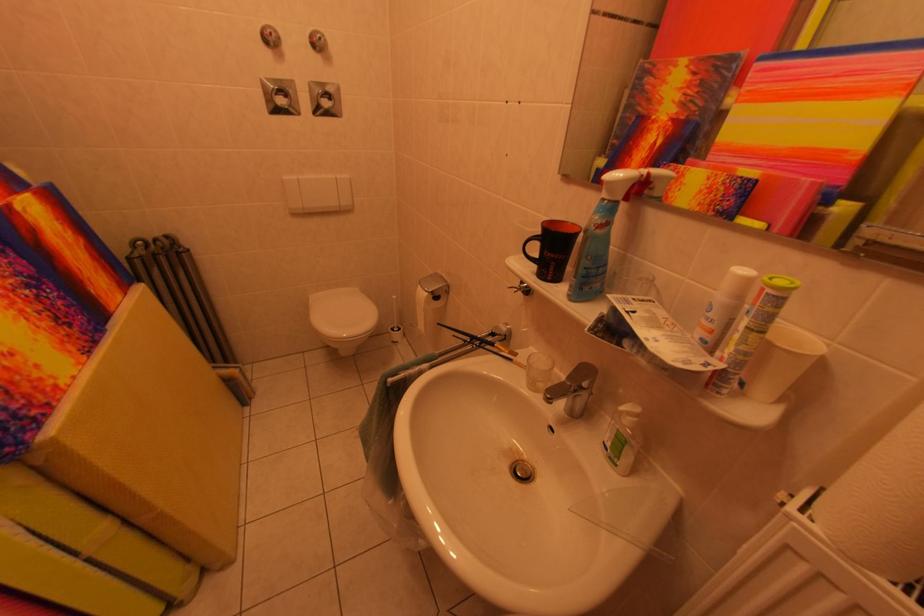
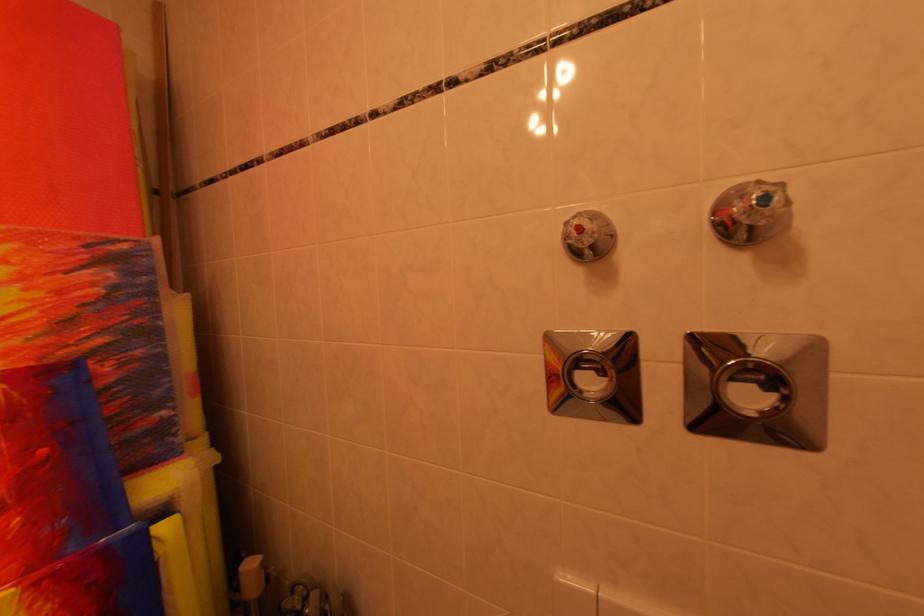
Where in the second image is the point corresponding to the point at 346,92 from the first image?

(824, 351)